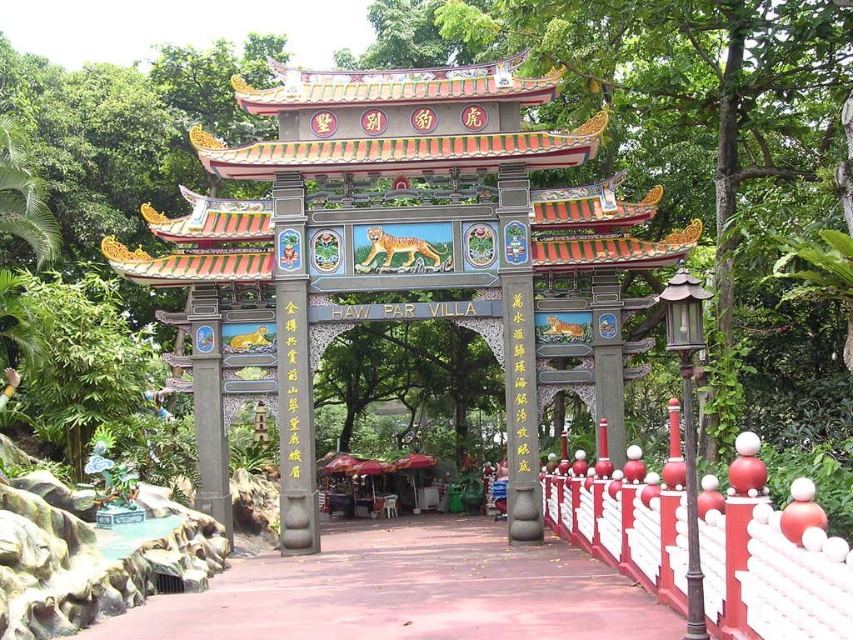
You are a visitor standing at the entrance of Haw Par Villa and want to walk along the red concrete path at lower left. Can you step over the white painted wood fence at lower right if you decide to leave the path?

The red concrete path at lower left has a lesser height compared to white painted wood fence at lower right, so stepping over the fence might be difficult due to its higher height compared to the path.

You are a tourist standing at the entrance of Haw Par Villa and want to take a photo of the gate. You notice the red concrete path at lower left and the white painted wood fence at lower right. Which object should you position yourself closer to if you want the other object to appear smaller in your photo?

Position yourself closer to the white painted wood fence at lower right. Since the red concrete path at lower left is to the left of the white painted wood fence at lower right, moving closer to the fence will make the path appear smaller in the photo.

You are a visitor at Haw Par Villa and want to walk from the entrance gate towards the main attractions. There are two paths available here. One is the red concrete path at lower left, and the other is the white painted wood fence at lower right. Which path is wider?

The red concrete path at lower left is wider than the white painted wood fence at lower right according to the description.